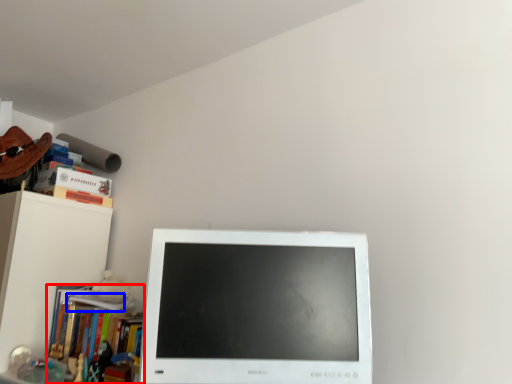
Question: Among these objects, which one is nearest to the camera, book (highlighted by a red box) or book (highlighted by a blue box)?

Choices:
 (A) book
 (B) book

Answer: (A)